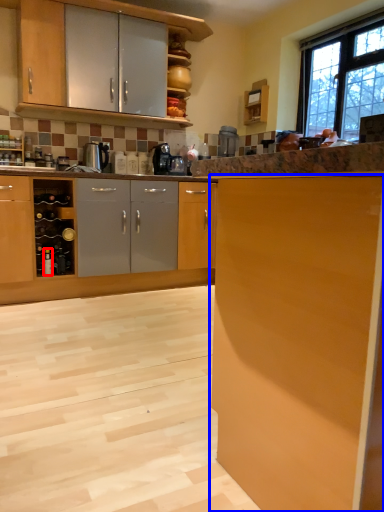
Question: Among these objects, which one is nearest to the camera, bottle (highlighted by a red box) or cabinetry (highlighted by a blue box)?

Choices:
 (A) bottle
 (B) cabinetry

Answer: (B)